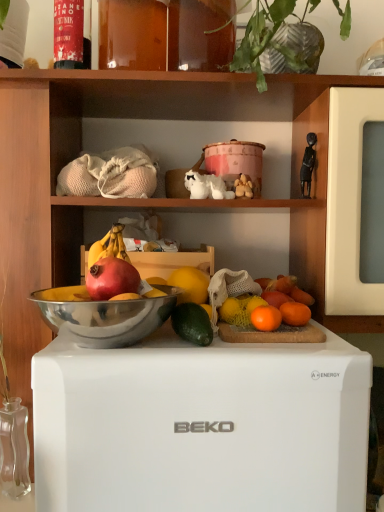
The height and width of the screenshot is (512, 384). I want to click on space that is in front of orange matte grapefruit at upper right, the second grapefruit from the back, so click(x=276, y=347).